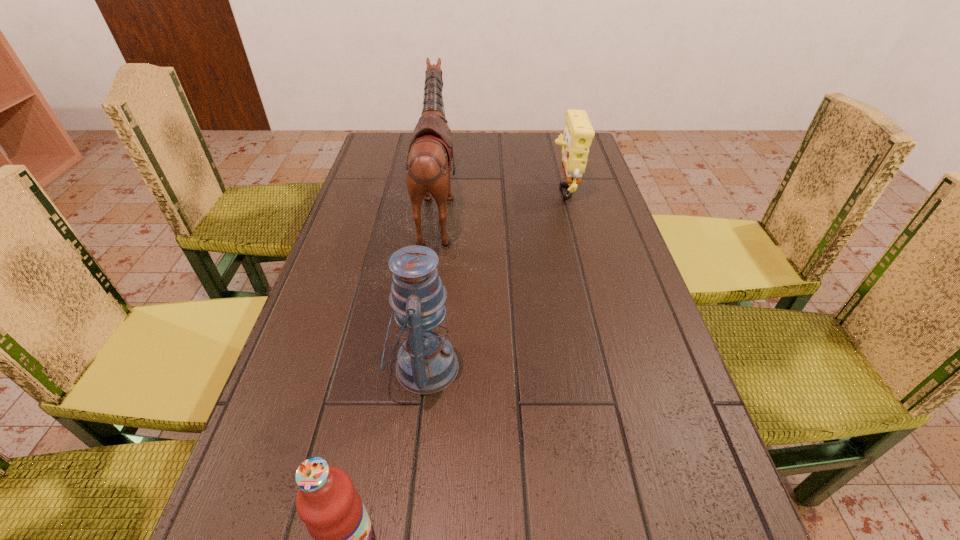
Where is `vacant space at the far edge`? This screenshot has width=960, height=540. vacant space at the far edge is located at coordinates point(526,153).

At what (x,y) coordinates should I click in order to perform the action: click on free space at the left edge. Please return your answer as a coordinate pair (x, y). The image size is (960, 540). Looking at the image, I should click on click(x=368, y=362).

This screenshot has height=540, width=960. Find the location of `vacant space at the right edge of the desktop`. vacant space at the right edge of the desktop is located at coordinates (642, 289).

This screenshot has width=960, height=540. Find the location of `free space at the far left corner`. free space at the far left corner is located at coordinates (391, 157).

The height and width of the screenshot is (540, 960). In the image, there is a desktop. Find the location of `free region at the far right corner`. free region at the far right corner is located at coordinates (554, 166).

The image size is (960, 540). In order to click on free spot between the third shortest object and the rightmost object in this screenshot , I will do `click(493, 278)`.

This screenshot has width=960, height=540. I want to click on free space between the saddle and the sponge, so 500,199.

Where is `vacant area that lies between the second nearest object and the sponge`? Image resolution: width=960 pixels, height=540 pixels. vacant area that lies between the second nearest object and the sponge is located at coordinates (493, 278).

Locate which object is the second closest to the second tallest object. Please provide its 2D coordinates. Your answer should be formatted as a tuple, i.e. [(x, y)], where the tuple contains the x and y coordinates of a point satisfying the conditions above.

[(428, 165)]

At what (x,y) coordinates should I click in order to perform the action: click on object that stands as the third closest to the saddle. Please return your answer as a coordinate pair (x, y). This screenshot has width=960, height=540. Looking at the image, I should click on (327, 502).